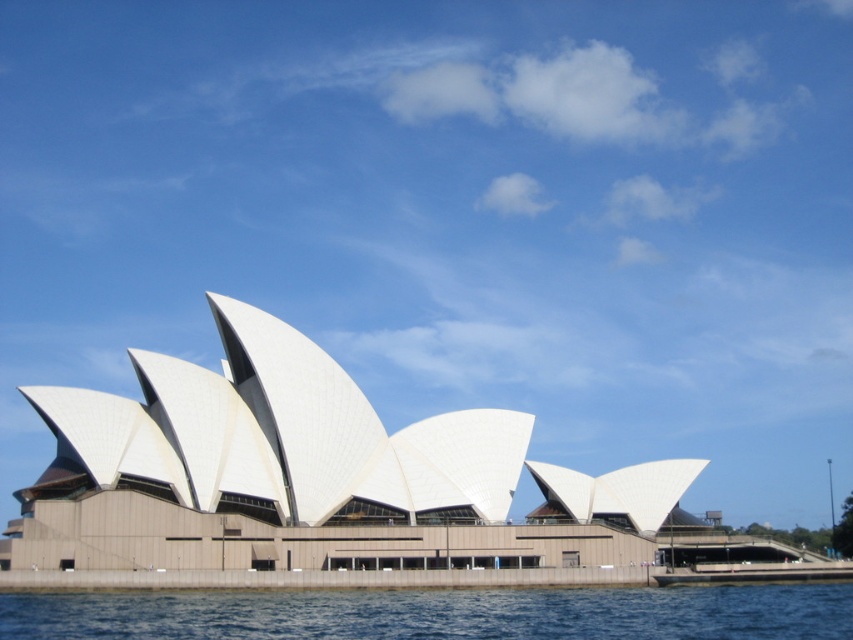
Can you confirm if white fabric opera house at center is positioned above blue water at lower center?

Yes, white fabric opera house at center is above blue water at lower center.

Can you confirm if white fabric opera house at center is wider than blue water at lower center?

Indeed, white fabric opera house at center has a greater width compared to blue water at lower center.

Where is `white fabric opera house at center`? The image size is (853, 640). white fabric opera house at center is located at coordinates (306, 476).

The height and width of the screenshot is (640, 853). I want to click on white fabric opera house at center, so click(x=306, y=476).